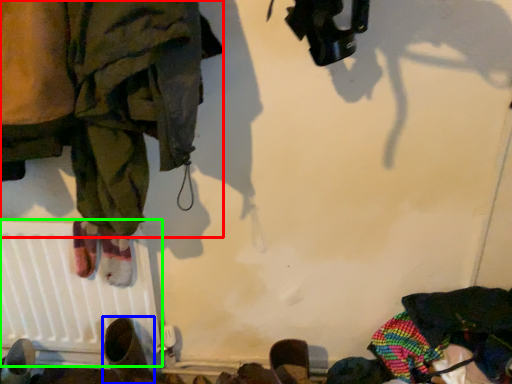
Question: Estimate the real-world distances between objects in this image. Which object is closer to clothing (highlighted by a red box), footwear (highlighted by a blue box) or radiator (highlighted by a green box)?

Choices:
 (A) footwear
 (B) radiator

Answer: (B)